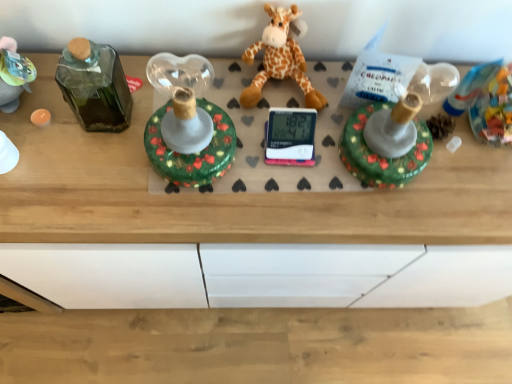
Question: From a real-world perspective, relative to soft plush giraffe at center, is shiny green glass candlestick at center vertically above or below?

Choices:
 (A) below
 (B) above

Answer: (B)

Question: From their relative heights in the image, would you say shiny green glass candlestick at center is taller or shorter than soft plush giraffe at center?

Choices:
 (A) short
 (B) tall

Answer: (B)

Question: Based on their positions, is shiny green glass candlestick at center located to the left or right of soft plush giraffe at center?

Choices:
 (A) right
 (B) left

Answer: (B)

Question: Looking at the image, does soft plush giraffe at center seem bigger or smaller compared to shiny green glass candlestick at center?

Choices:
 (A) big
 (B) small

Answer: (B)

Question: Is soft plush giraffe at center wider or thinner than shiny green glass candlestick at center?

Choices:
 (A) wide
 (B) thin

Answer: (B)

Question: From a real-world perspective, relative to shiny green glass candlestick at center, is soft plush giraffe at center vertically above or below?

Choices:
 (A) below
 (B) above

Answer: (A)

Question: Considering their positions, is soft plush giraffe at center located in front of or behind shiny green glass candlestick at center?

Choices:
 (A) front
 (B) behind

Answer: (B)